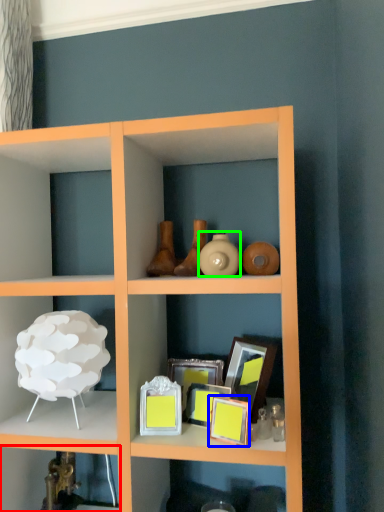
Question: Considering the real-world distances, which object is closest to shelf (highlighted by a red box)? picture frame (highlighted by a blue box) or vase (highlighted by a green box).

Choices:
 (A) picture frame
 (B) vase

Answer: (A)